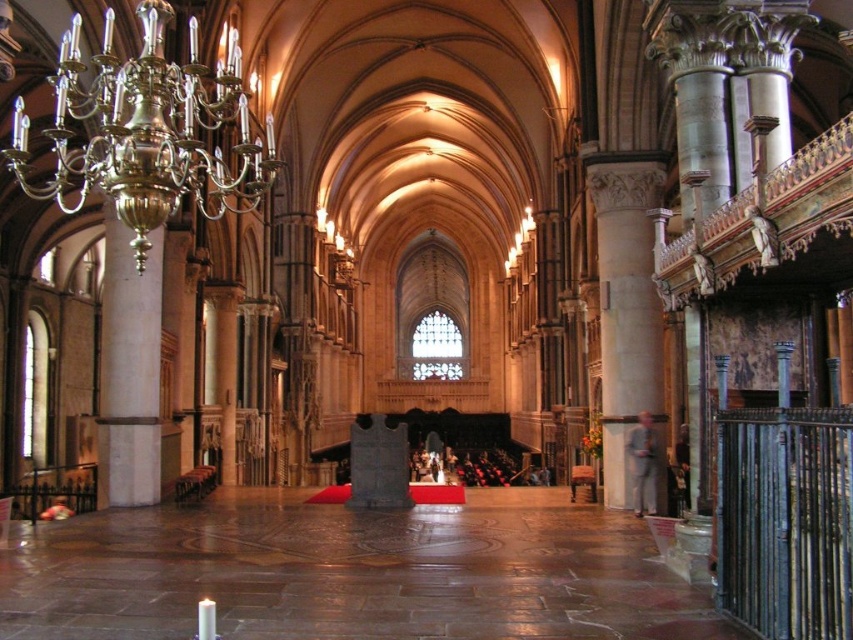
Can you confirm if white stone column at right is positioned below white wax candle at lower left?

No, white stone column at right is not below white wax candle at lower left.

Which of these two, white stone column at right or white wax candle at lower left, stands shorter?

With less height is white wax candle at lower left.

Where is `white stone column at right`? The height and width of the screenshot is (640, 853). white stone column at right is located at coordinates (625, 305).

Consider the image. Does gold polished chandelier at upper left have a larger size compared to white wax candle at lower left?

Yes, gold polished chandelier at upper left is bigger than white wax candle at lower left.

Is gold polished chandelier at upper left positioned in front of white wax candle at lower left?

That is False.

Who is more distant from viewer, (97, 131) or (207, 621)?

Positioned behind is point (97, 131).

Where is `gold polished chandelier at upper left`? This screenshot has width=853, height=640. gold polished chandelier at upper left is located at coordinates (149, 129).

Between point (612, 272) and point (115, 246), which one is positioned behind?

Point (612, 272)

Which is in front, point (612, 266) or point (143, 422)?

Point (143, 422) is in front.

Is point (659, 189) less distant than point (138, 500)?

That is False.

Find the location of a particular element. The height and width of the screenshot is (640, 853). white stone column at right is located at coordinates (625, 305).